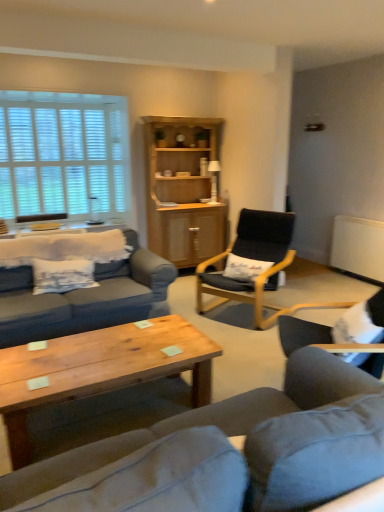
I want to click on free location above wooden coffee table at center (from a real-world perspective), so click(x=90, y=356).